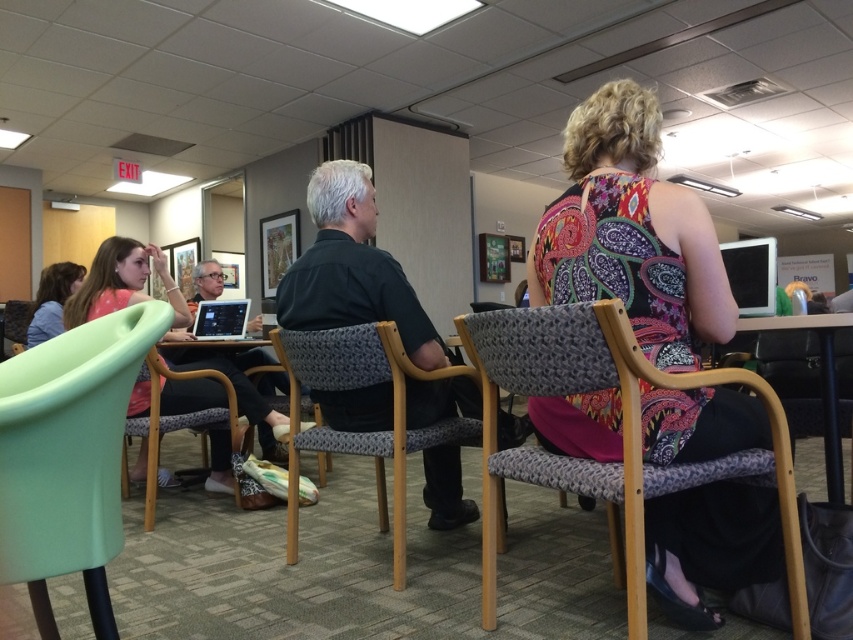
Question: Can you confirm if mint green plastic chair at lower left is positioned above wooden table at lower right?

Choices:
 (A) yes
 (B) no

Answer: (A)

Question: Considering the real-world distances, which object is farthest from the black woven chair at center?

Choices:
 (A) mint green plastic chair at lower left
 (B) black glossy tablet at upper right
 (C) patterned fabric chair at center

Answer: (B)

Question: Among these objects, which one is farthest from the camera?

Choices:
 (A) black glossy tablet at upper right
 (B) wooden table at lower right
 (C) black woven chair at center

Answer: (A)

Question: Can you confirm if gray woven fabric chair at center is positioned to the right of matte green chair at left?

Choices:
 (A) yes
 (B) no

Answer: (A)

Question: Can you confirm if gray woven fabric chair at center is positioned below matte green chair at left?

Choices:
 (A) no
 (B) yes

Answer: (B)

Question: Estimate the real-world distances between objects in this image. Which object is closer to the matte pink shirt at left?

Choices:
 (A) matte green chair at left
 (B) black woven chair at center
 (C) matte black shirt at center

Answer: (A)